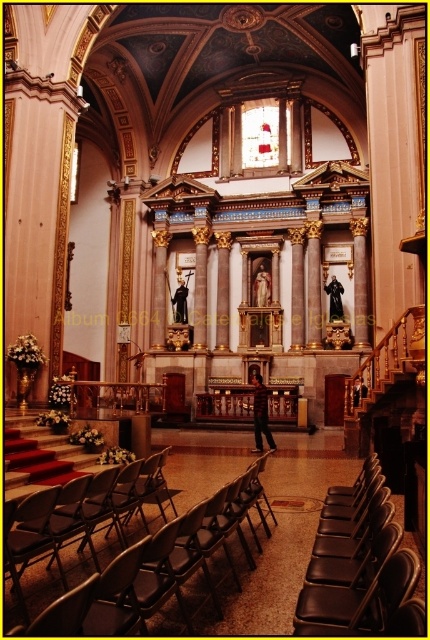
From the picture: You are a visitor standing at the entrance of the cathedral and want to sit down. You see the metallic silver chair at center and the black statue at center. Which one is shorter and more suitable for sitting?

The metallic silver chair at center is not as tall as the black statue at center, so it is shorter and more suitable for sitting.

You are standing in the cathedral and want to place a 1.5 meter wide painting between the black leather chairs at lower right and the black statue at center. Is there enough space?

The distance between the black leather chairs at lower right and the black statue at center is 54.26 meters, so yes, there is enough space to place a 1.5 meter wide painting between them since the distance is much larger than the painting.